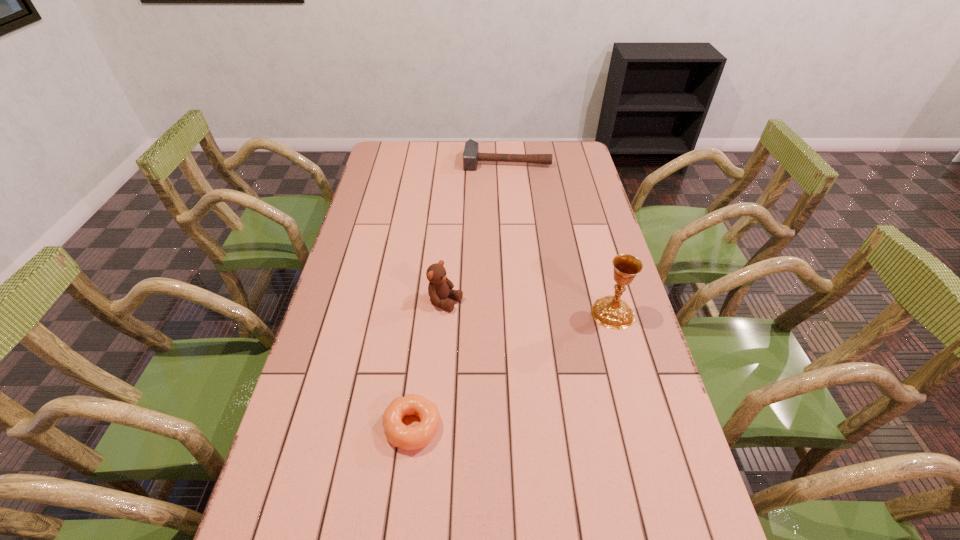
Image resolution: width=960 pixels, height=540 pixels. What are the coordinates of `vacant space on the desktop that is between the nearest object and the tallest object and is positioned on the face of the second tallest object` in the screenshot? It's located at (549, 349).

Identify the location of vacant spot on the desktop that is between the doughnut and the chalice and is positioned on the striking surface of the hammer. The image size is (960, 540). (495, 379).